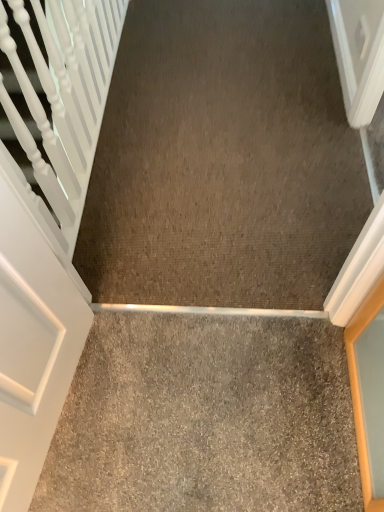
Question: Would you say gray carpet at center, the 1th concrete when ordered from front to back, is to the left or to the right of brown carpet at center, marked as the 2th concrete in a bottom-to-top arrangement, in the picture?

Choices:
 (A) left
 (B) right

Answer: (A)

Question: Looking at their shapes, would you say gray carpet at center, placed as the second concrete when sorted from top to bottom, is wider or thinner than brown carpet at center, the 1th concrete in the back-to-front sequence?

Choices:
 (A) thin
 (B) wide

Answer: (A)

Question: Considering the positions of gray carpet at center, the 1th concrete when ordered from front to back, and brown carpet at center, placed as the first concrete when sorted from top to bottom, in the image, is gray carpet at center, the 1th concrete when ordered from front to back, taller or shorter than brown carpet at center, placed as the first concrete when sorted from top to bottom,?

Choices:
 (A) tall
 (B) short

Answer: (B)

Question: Based on their positions, is brown carpet at center, placed as the first concrete when sorted from top to bottom, located to the left or right of gray carpet at center, the 1th concrete when ordered from front to back?

Choices:
 (A) right
 (B) left

Answer: (A)

Question: In terms of width, does brown carpet at center, placed as the first concrete when sorted from top to bottom, look wider or thinner when compared to gray carpet at center, the 1th concrete when ordered from front to back?

Choices:
 (A) thin
 (B) wide

Answer: (B)

Question: Is point (281, 37) positioned closer to the camera than point (317, 331)?

Choices:
 (A) farther
 (B) closer

Answer: (A)

Question: Considering the positions of brown carpet at center, placed as the 2th concrete when sorted from front to back, and gray carpet at center, placed as the second concrete when sorted from top to bottom, in the image, is brown carpet at center, placed as the 2th concrete when sorted from front to back, taller or shorter than gray carpet at center, placed as the second concrete when sorted from top to bottom,?

Choices:
 (A) tall
 (B) short

Answer: (A)